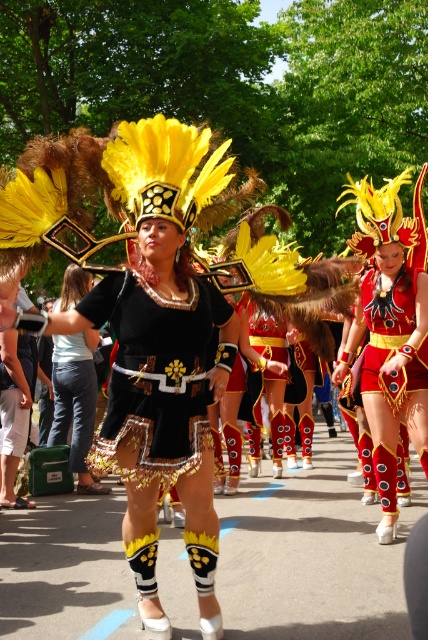
In the parade scene, you notice two performers wearing the shiny red fabric dress at center and the matte black dress at center. Which performer is standing in a position that makes them appear taller?

The shiny red fabric dress at center is taller than the matte black dress at center, so the performer in the shiny red fabric dress at center appears taller.

You are a photographer standing at the edge of the parade. You want to take a photo that includes both the matte black dress at center and the shiny red fabric shorts at center. If your camera has a maximum focus range of 10 feet, will you be able to capture both subjects in focus?

The distance between the matte black dress at center and the shiny red fabric shorts at center is 9.58 feet, which is within the camera maximum focus range of 10 feet. Therefore, you can capture both subjects in focus.